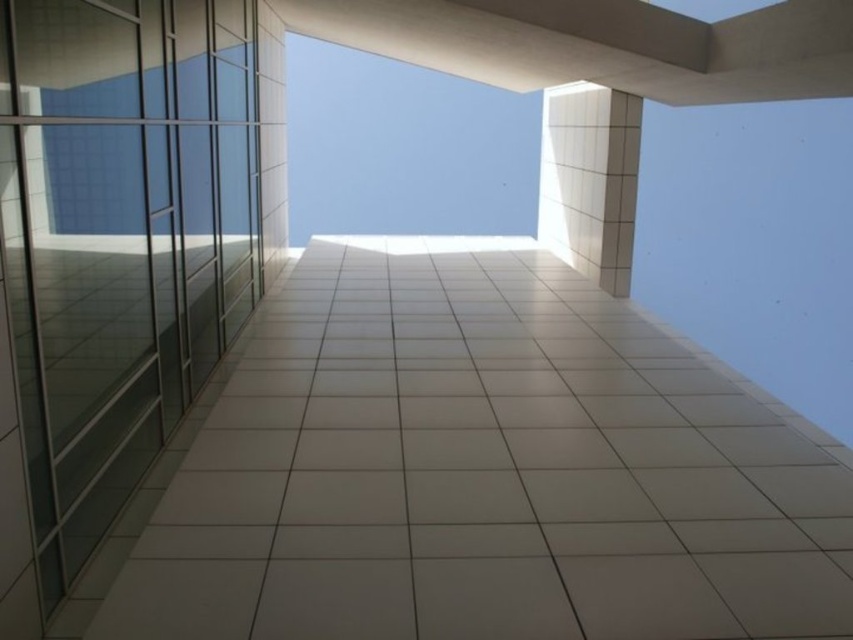
Who is shorter, transparent glass elevator at left or white tile pillar at upper right?

transparent glass elevator at left is shorter.

Can you confirm if transparent glass elevator at left is positioned to the right of white tile pillar at upper right?

Incorrect, transparent glass elevator at left is not on the right side of white tile pillar at upper right.

In order to click on transparent glass elevator at left in this screenshot , I will do `click(119, 241)`.